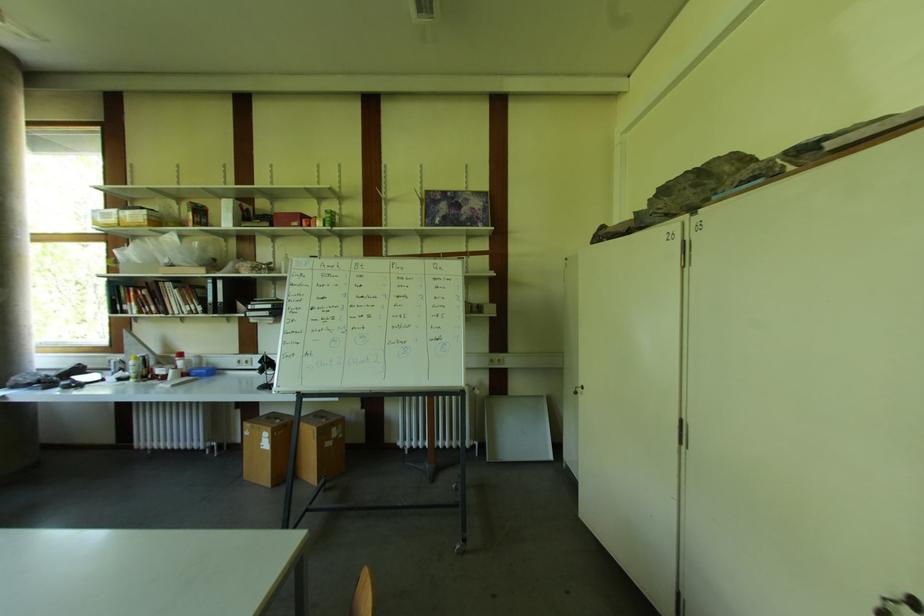
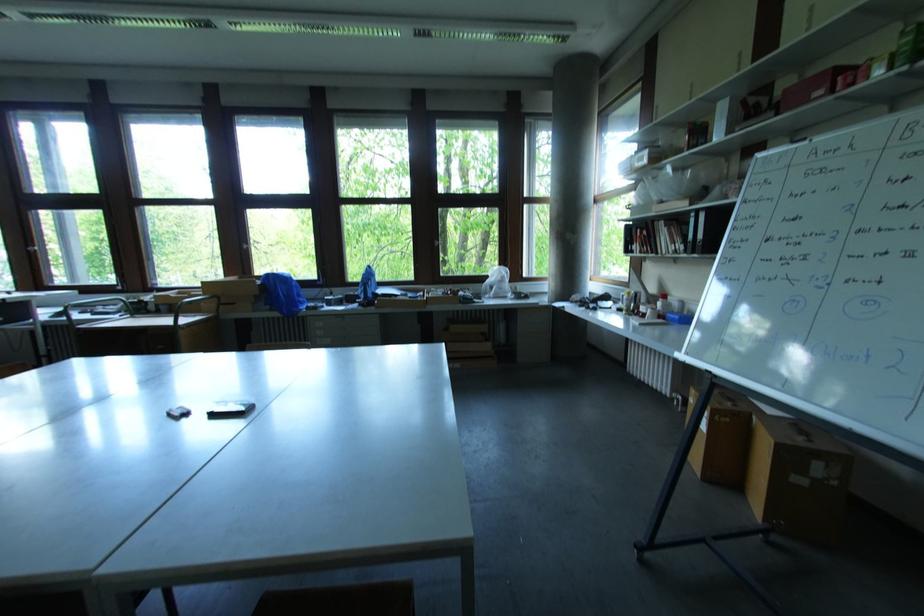
Locate, in the second image, the point that corresponds to point 184,357 in the first image.

(667, 298)